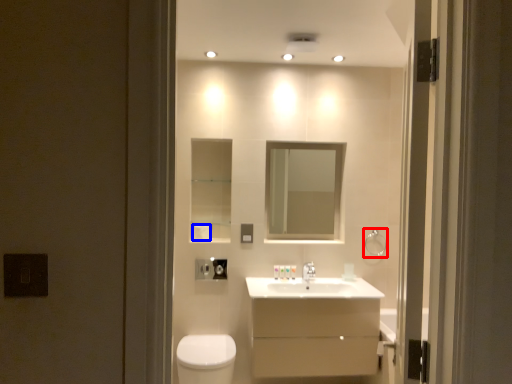
Question: Among these objects, which one is farthest to the camera, towel bar (highlighted by a red box) or toilet paper (highlighted by a blue box)?

Choices:
 (A) towel bar
 (B) toilet paper

Answer: (A)